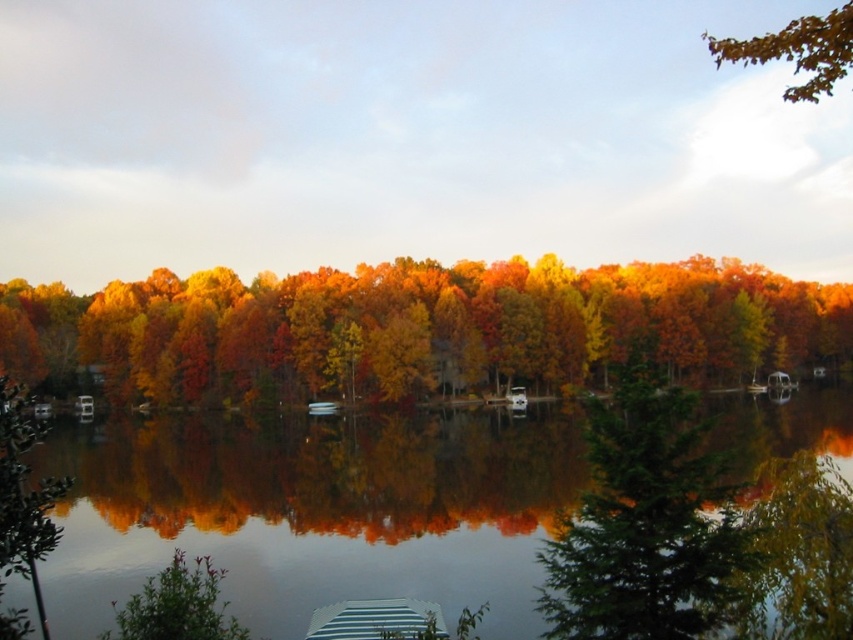
You are standing at the lakeside and want to determine which of the two points, point (213, 484) or point (798, 38), is closer to you. Based on the scene, which point is nearer?

Point (213, 484) is closer to you because it is further to the viewer than point (798, 38).

You are standing on the lakeside path and see the transparent water at center and the orange matte tree at center. Which object is closer to you?

The transparent water at center is positioned under the orange matte tree at center, so the orange matte tree at center is closer to you.